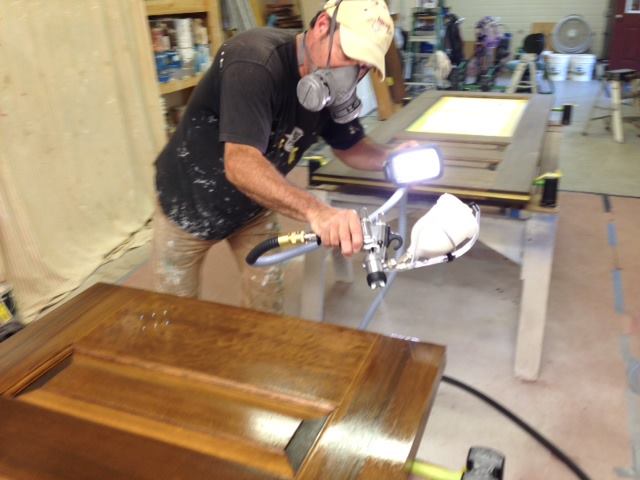
The height and width of the screenshot is (480, 640). In order to click on lighting in this screenshot , I will do `click(413, 168)`.